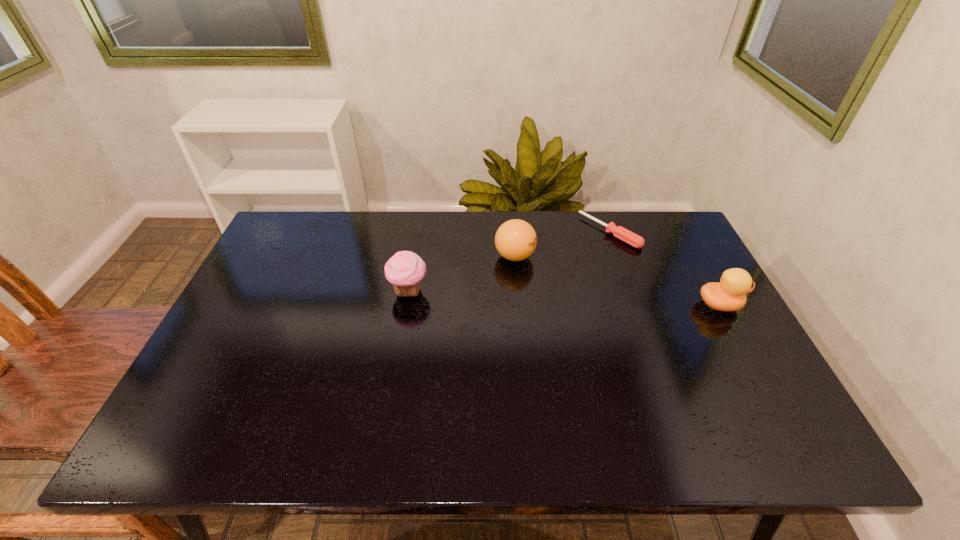
Locate an element on the screen. Image resolution: width=960 pixels, height=540 pixels. vacant region at the far left corner of the desktop is located at coordinates (287, 212).

Identify the location of free region at the near left corner. The image size is (960, 540). (203, 382).

Find the location of a particular element. The image size is (960, 540). vacant area at the far right corner is located at coordinates (648, 221).

The width and height of the screenshot is (960, 540). In order to click on free spot between the ping-pong ball and the rightmost object in this screenshot , I will do `click(617, 280)`.

You are a GUI agent. You are given a task and a screenshot of the screen. Output one action in this format:
    pyautogui.click(x=<x>, y=<y>)
    Task: Click on the free space between the shortest object and the second object from left to right
    The width and height of the screenshot is (960, 540).
    Given the screenshot: What is the action you would take?
    pyautogui.click(x=562, y=244)

Identify the location of free spot between the shortest object and the duckling. (664, 268).

Where is `free space between the leftmost object and the duckling`? The image size is (960, 540). free space between the leftmost object and the duckling is located at coordinates (564, 298).

This screenshot has height=540, width=960. Find the location of `free space between the ping-pong ball and the screwdriver`. free space between the ping-pong ball and the screwdriver is located at coordinates (562, 244).

You are a GUI agent. You are given a task and a screenshot of the screen. Output one action in this format:
    pyautogui.click(x=<x>, y=<y>)
    Task: Click on the unoccupied position between the ping-pong ball and the cupcake
    The image size is (960, 540).
    Given the screenshot: What is the action you would take?
    pyautogui.click(x=462, y=273)

You are a GUI agent. You are given a task and a screenshot of the screen. Output one action in this format:
    pyautogui.click(x=<x>, y=<y>)
    Task: Click on the vacant area between the ping-pong ball and the leftmost object
    Image resolution: width=960 pixels, height=540 pixels.
    Given the screenshot: What is the action you would take?
    tap(462, 273)